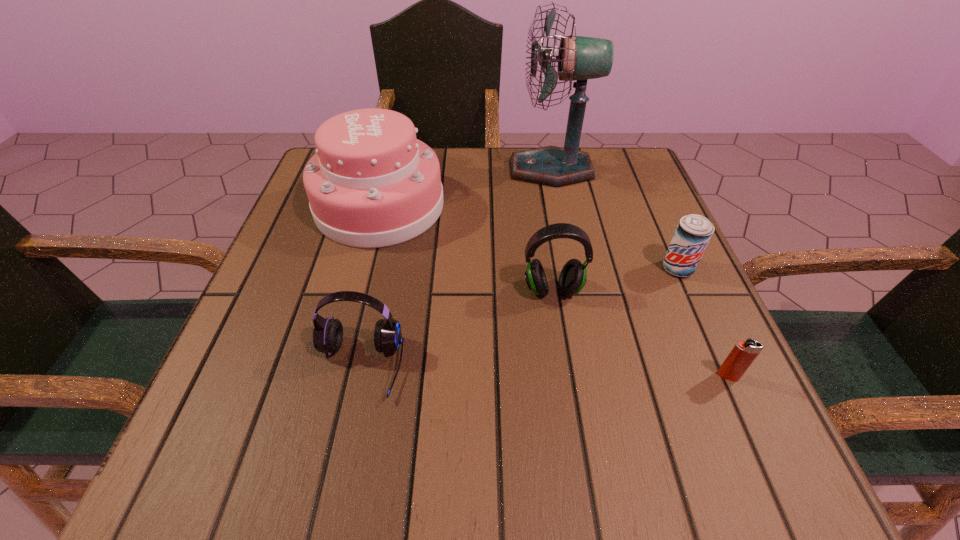
At what (x,y) coordinates should I click in order to perform the action: click on free point between the tallest object and the beer can. Please return your answer as a coordinate pair (x, y). This screenshot has width=960, height=540. Looking at the image, I should click on (614, 219).

The width and height of the screenshot is (960, 540). I want to click on vacant area between the birthday cake and the shortest object, so coord(554,291).

Where is `empty space between the fifth shortest object and the tallest object`? This screenshot has width=960, height=540. empty space between the fifth shortest object and the tallest object is located at coordinates (466, 188).

Identify the location of vacant area that lies between the fan and the beer can. The width and height of the screenshot is (960, 540). (614, 219).

This screenshot has width=960, height=540. I want to click on free space between the igniter and the farther headset, so click(640, 333).

This screenshot has height=540, width=960. What are the coordinates of `vacant region between the left headset and the birthday cake` in the screenshot? It's located at pos(370,286).

Identify the location of free space between the tallest object and the beer can. (614, 219).

Find the location of `free area in between the igniter and the tallest object`. free area in between the igniter and the tallest object is located at coordinates (639, 273).

Find the location of a particular element. Image resolution: width=960 pixels, height=540 pixels. free space that is in between the farther headset and the birthday cake is located at coordinates (467, 248).

Where is `object that is the fifth closest to the left headset`? object that is the fifth closest to the left headset is located at coordinates (742, 355).